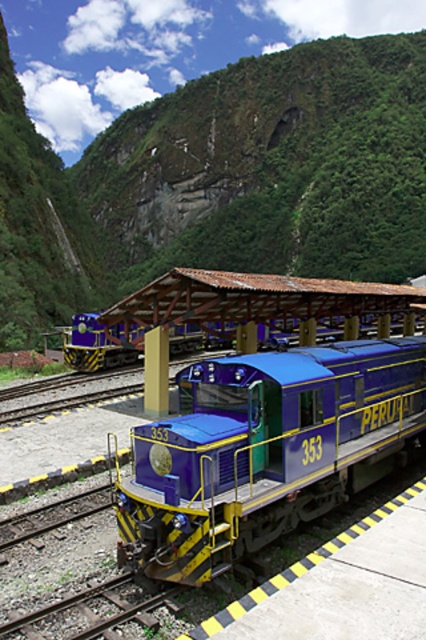
You are a passenger waiting on the platform at the railway station. You see the metallic blue train at center and the matte blue train at center. Which train is closer to the platform edge?

The metallic blue train at center is closer to the platform edge because it is positioned to the left of the matte blue train at center, and the platform edge is on the left side of the platform.

You are a railway engineer designing a new track layout. The metallic blue train at center and the matte blue train at center need to pass through a tunnel that can only accommodate the narrower of the two. Which train should be prioritized to go through the tunnel first?

The metallic blue train at center should be prioritized because its width is less than the matte blue train at center, making it the narrower option and safer to pass through the tunnel first.